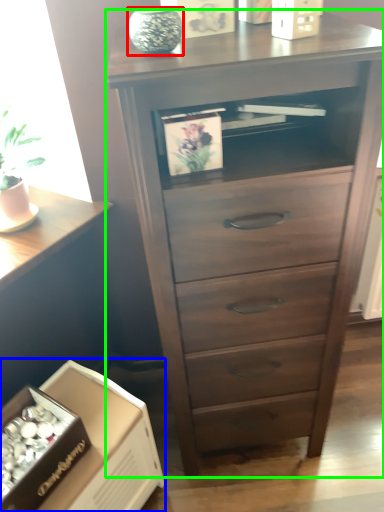
Question: Which is farther away from glass vase (highlighted by a red box)? cardboard box (highlighted by a blue box) or chest of drawers (highlighted by a green box)?

Choices:
 (A) cardboard box
 (B) chest of drawers

Answer: (A)